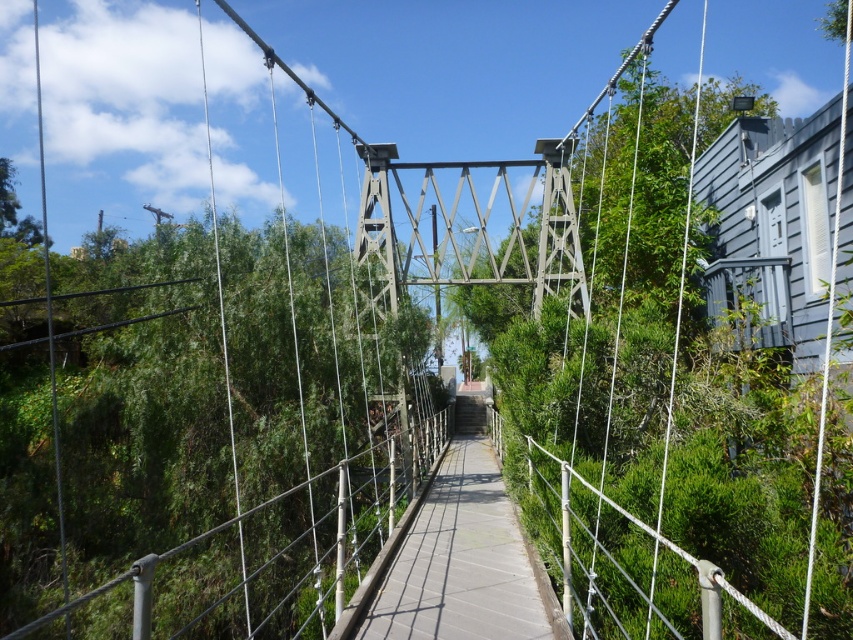
Question: Which object is closer to the camera taking this photo?

Choices:
 (A) concrete walkway at center
 (B) green leafy tree at center

Answer: (B)

Question: Which of the following is the farthest from the observer?

Choices:
 (A) green leafy tree at center
 (B) concrete walkway at center

Answer: (B)

Question: Is green leafy tree at center positioned before concrete walkway at center?

Choices:
 (A) no
 (B) yes

Answer: (B)

Question: Observing the image, what is the correct spatial positioning of green leafy tree at center in reference to concrete walkway at center?

Choices:
 (A) below
 (B) above

Answer: (B)

Question: Does green leafy tree at center appear over concrete walkway at center?

Choices:
 (A) no
 (B) yes

Answer: (B)

Question: Which point is farther to the camera?

Choices:
 (A) concrete walkway at center
 (B) green leafy tree at center

Answer: (A)